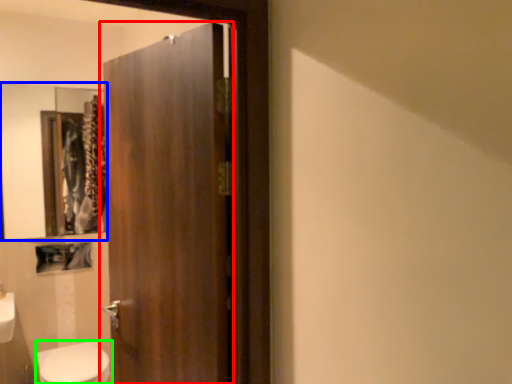
Question: Which is nearer to the door (highlighted by a red box)? mirror (highlighted by a blue box) or bidet (highlighted by a green box).

Choices:
 (A) mirror
 (B) bidet

Answer: (B)